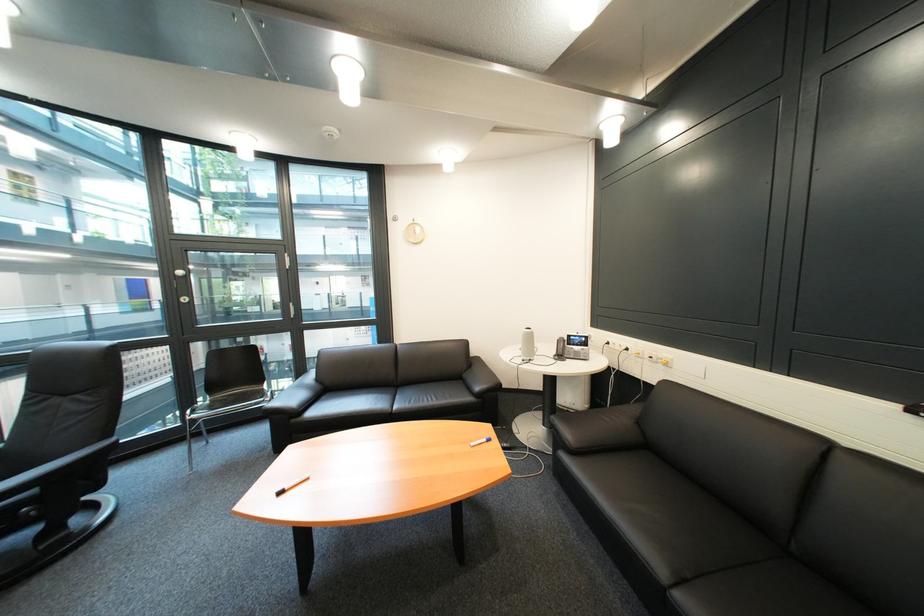
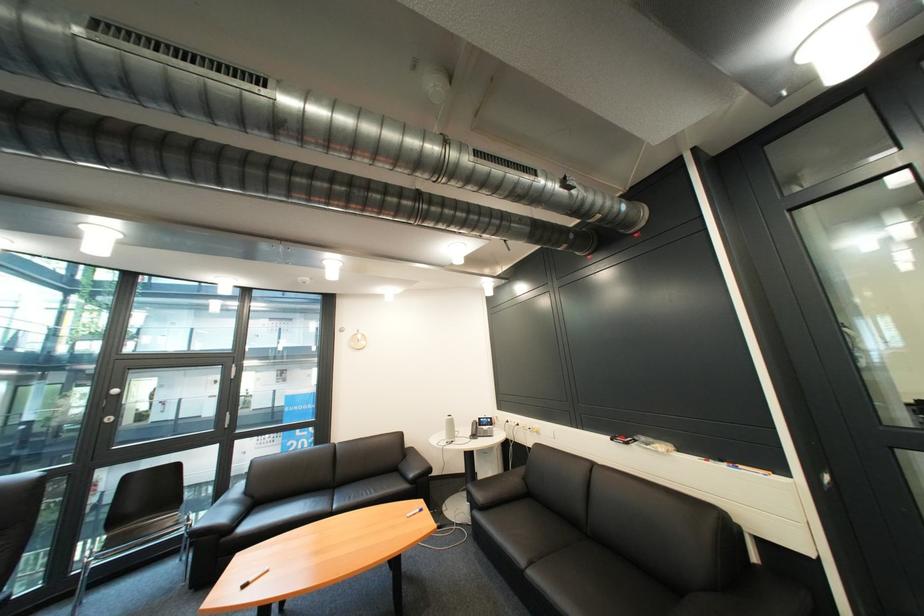
In the second image, find the point that corresponds to point (675, 368) in the first image.

(549, 435)